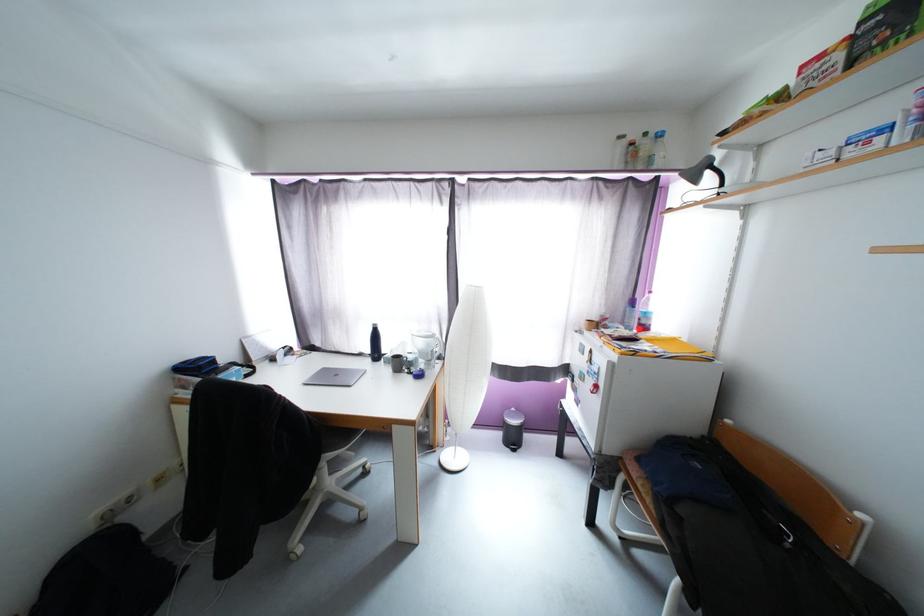
The width and height of the screenshot is (924, 616). I want to click on grey mug, so click(x=427, y=345).